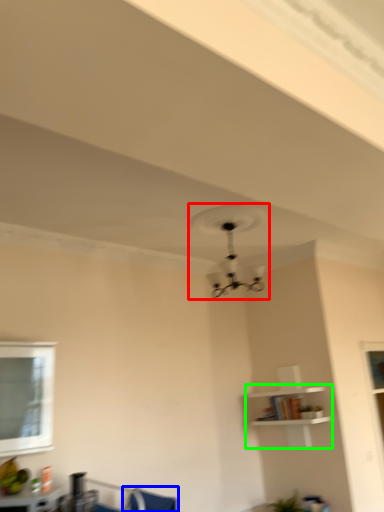
Question: Which object is the farthest from fan (highlighted by a red box)? Choose among these: swivel chair (highlighted by a blue box) or shelf (highlighted by a green box).

Choices:
 (A) swivel chair
 (B) shelf

Answer: (A)